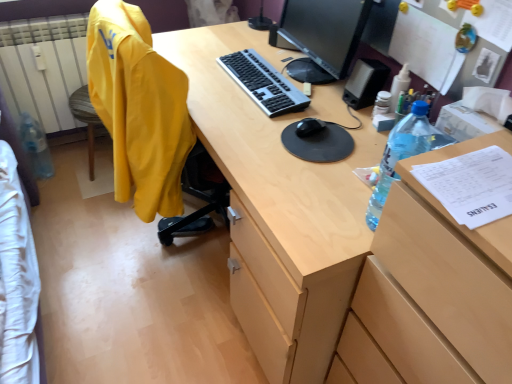
Identify the location of unoccupied space behind black matte mouse at center. The image size is (512, 384). (308, 99).